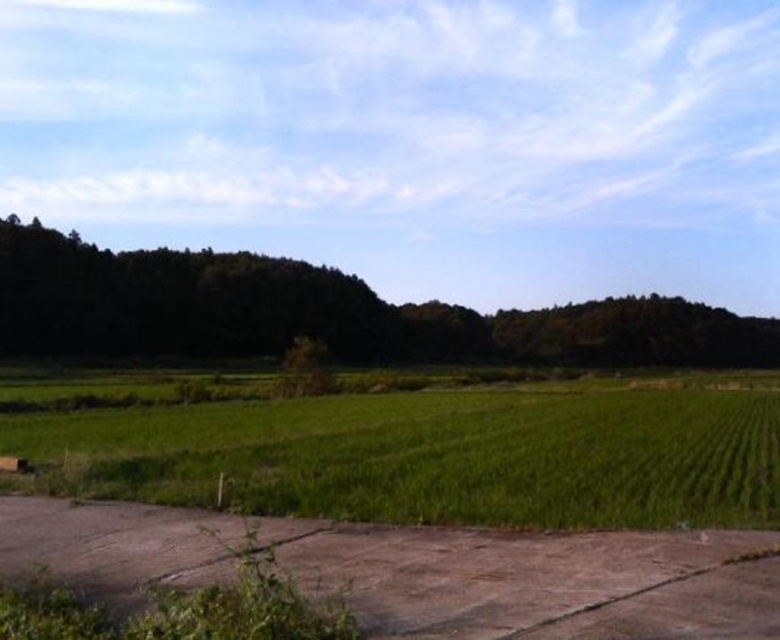
Describe the element at coordinates (438, 454) in the screenshot. I see `green grass at lower left` at that location.

Who is positioned more to the right, green grass at lower left or dark green leafy tree at center?

From the viewer's perspective, dark green leafy tree at center appears more on the right side.

Who is more forward, [777,520] or [254,296]?

Point [777,520] is more forward.

Image resolution: width=780 pixels, height=640 pixels. I want to click on green grass at lower left, so click(438, 454).